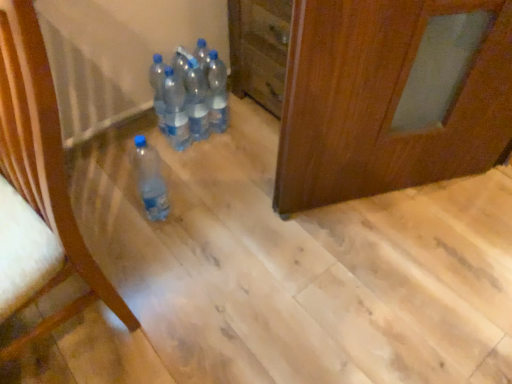
At what (x,y) coordinates should I click in order to perform the action: click on vacant area on the back side of clear plastic bottle at left. Please return your answer as a coordinate pair (x, y). The height and width of the screenshot is (384, 512). Looking at the image, I should click on (130, 217).